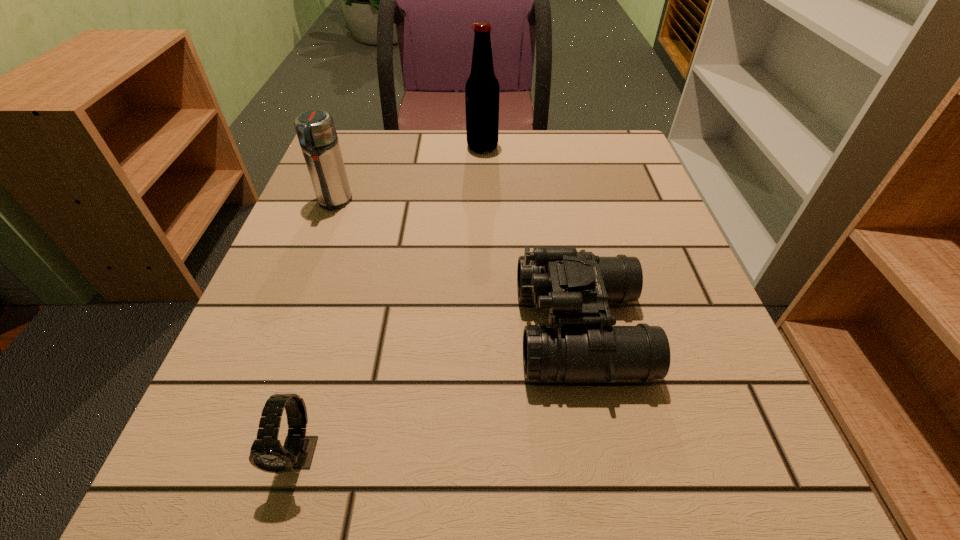
What are the coordinates of `empty space that is in between the third shortest object and the tallest object` in the screenshot? It's located at click(408, 174).

Identify the location of free space between the second object from right to left and the thermos bottle. (408, 174).

Find the location of a particular element. This screenshot has height=540, width=960. vacant space that is in between the shortest object and the beer bottle is located at coordinates (391, 300).

At what (x,y) coordinates should I click in order to perform the action: click on vacant region between the third nearest object and the watch. Please return your answer as a coordinate pair (x, y). The height and width of the screenshot is (540, 960). Looking at the image, I should click on (317, 328).

I want to click on unoccupied position between the third shortest object and the watch, so click(317, 328).

Find the location of a particular element. object that ranks as the third closest to the watch is located at coordinates (482, 88).

Locate which object ranks in proximity to the watch. Please provide its 2D coordinates. Your answer should be formatted as a tuple, i.e. [(x, y)], where the tuple contains the x and y coordinates of a point satisfying the conditions above.

[(580, 344)]

Where is `vacant area that satisfies the following two spatial constraints: 1. through the lenses of the second nearest object; 2. on the face of the shortest object`? The image size is (960, 540). vacant area that satisfies the following two spatial constraints: 1. through the lenses of the second nearest object; 2. on the face of the shortest object is located at coordinates (605, 453).

At what (x,y) coordinates should I click in order to perform the action: click on free location that satisfies the following two spatial constraints: 1. through the lenses of the binoculars; 2. on the face of the watch. Please return your answer as a coordinate pair (x, y). The height and width of the screenshot is (540, 960). Looking at the image, I should click on (605, 453).